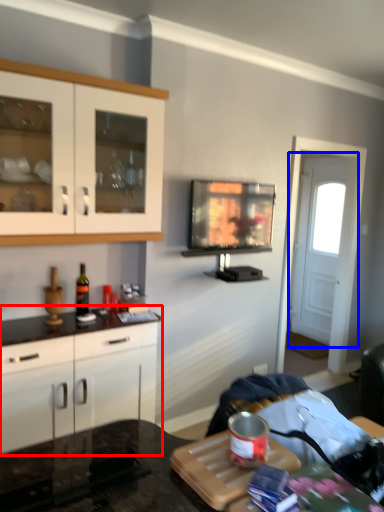
Question: Which object is closer to the camera taking this photo, cabinetry (highlighted by a red box) or door (highlighted by a blue box)?

Choices:
 (A) cabinetry
 (B) door

Answer: (A)